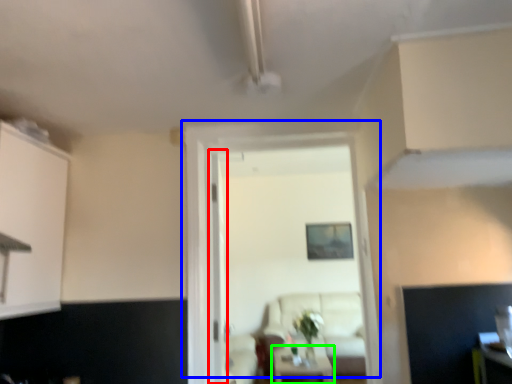
Question: Which object is positioned farthest from glass door (highlighted by a red box)? Select from door (highlighted by a blue box) and table (highlighted by a green box).

Choices:
 (A) door
 (B) table

Answer: (B)